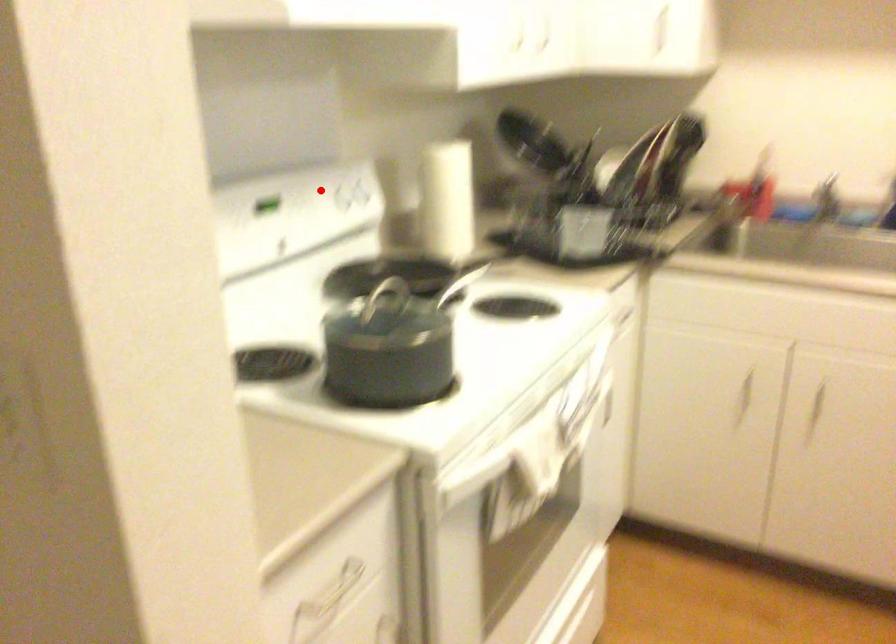
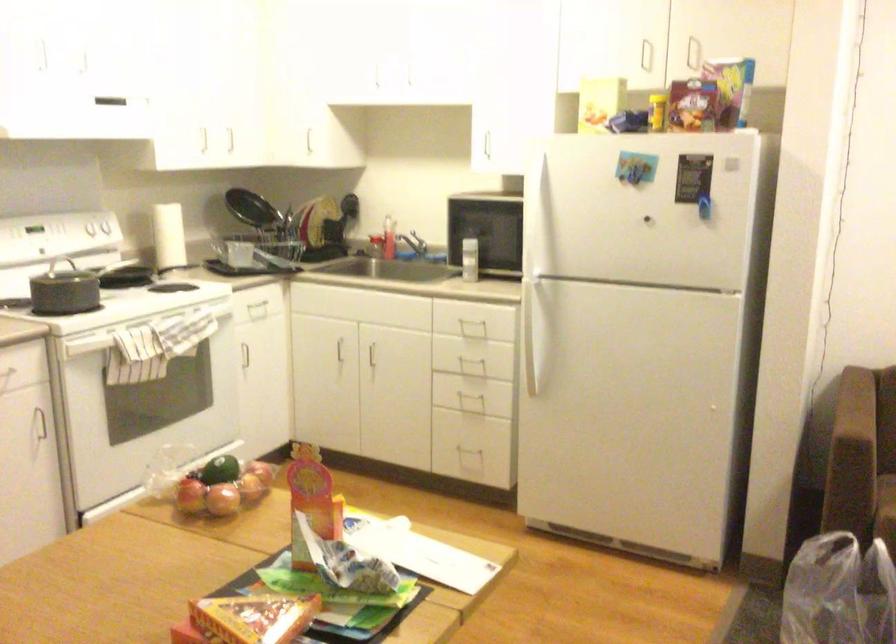
Where in the second image is the point corresponding to the highlighted location from the first image?

(98, 232)